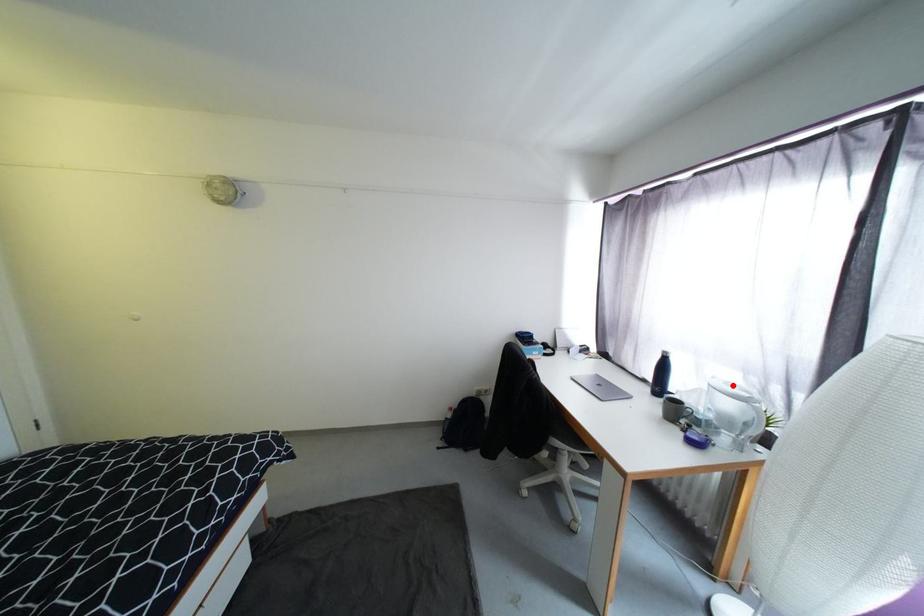
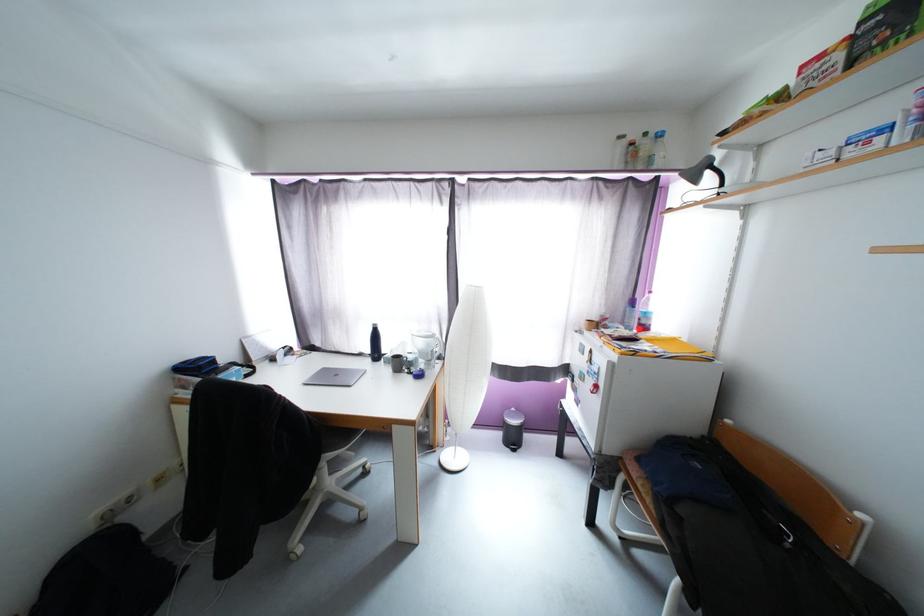
Where in the second image is the point corresponding to the highlighted location from the first image?

(424, 333)